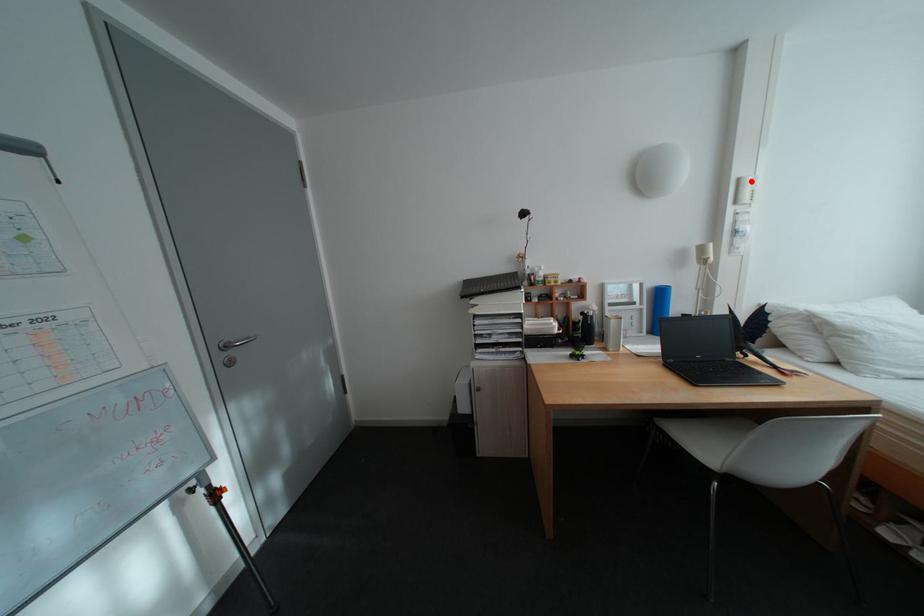
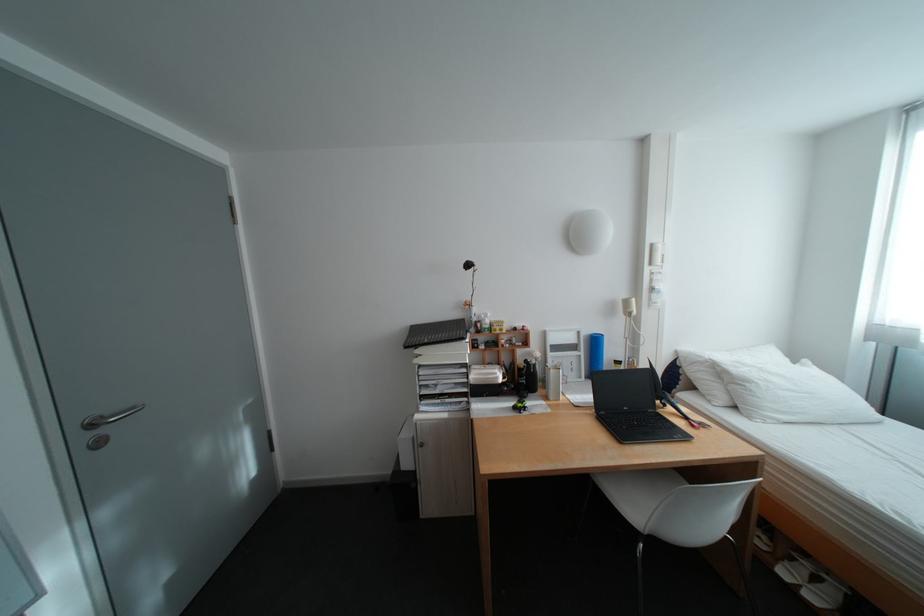
Question: I am providing you with two images of the same scene from different viewpoints. A red point is marked on the first image. Can you still see the location of the red point in image 2?

Choices:
 (A) Yes
 (B) No

Answer: (A)